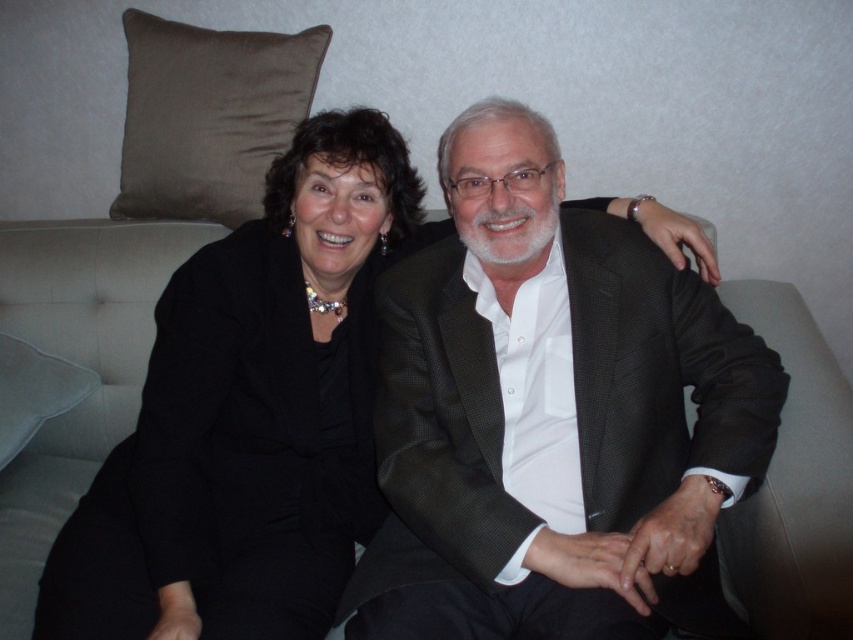
Between point (165, 113) and point (4, 412), which one is positioned in front?

Point (4, 412) is in front.

Is brown suede pillow at upper left above white fabric pillow at left?

Yes.

Image resolution: width=853 pixels, height=640 pixels. Find the location of `brown suede pillow at upper left`. brown suede pillow at upper left is located at coordinates pos(207,116).

This screenshot has width=853, height=640. In order to click on brown suede pillow at upper left in this screenshot , I will do `click(207, 116)`.

Looking at this image, is matte black suit at center thinner than brown suede pillow at upper left?

Incorrect, matte black suit at center's width is not less than brown suede pillow at upper left's.

Does matte black suit at center appear under brown suede pillow at upper left?

Yes.

Who is more distant from viewer, (x=390, y=288) or (x=294, y=128)?

Positioned behind is point (x=294, y=128).

Identify the location of matte black suit at center. Image resolution: width=853 pixels, height=640 pixels. (552, 417).

Is the position of black woolen suit at left more distant than that of brown suede pillow at upper left?

That is False.

Does point (257, 422) come in front of point (173, 22)?

Yes, it is in front of point (173, 22).

Image resolution: width=853 pixels, height=640 pixels. I want to click on black woolen suit at left, so pyautogui.click(x=231, y=460).